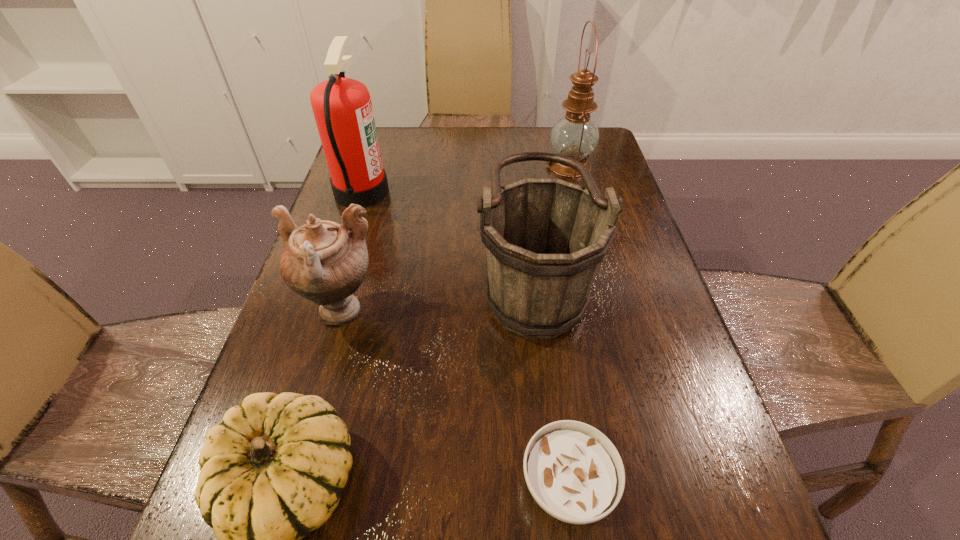
Where is `oil lamp`? The image size is (960, 540). oil lamp is located at coordinates (575, 135).

Image resolution: width=960 pixels, height=540 pixels. I want to click on fire extinguisher, so click(342, 107).

Locate an element on the screen. The image size is (960, 540). bucket is located at coordinates (545, 239).

At what (x,y) coordinates should I click in order to perform the action: click on urn. Please return your answer as a coordinate pair (x, y). Looking at the image, I should click on (322, 261).

You are a GUI agent. You are given a task and a screenshot of the screen. Output one action in this format:
    pyautogui.click(x=<x>, y=<y>)
    Task: Click on the soup bowl
    This screenshot has width=960, height=540.
    Given the screenshot: What is the action you would take?
    pyautogui.click(x=573, y=471)

Find the location of a particular element. This screenshot has width=960, height=540. vacant space situated on the left of the oil lamp is located at coordinates (420, 166).

Where is `vacant space located at the nozzle of the fire extinguisher`? vacant space located at the nozzle of the fire extinguisher is located at coordinates (414, 192).

Where is `free space located on the handle side of the bucket`? The height and width of the screenshot is (540, 960). free space located on the handle side of the bucket is located at coordinates (324, 282).

In order to click on free space located 0.200m on the handle side of the bucket in this screenshot , I will do `click(387, 282)`.

The width and height of the screenshot is (960, 540). Find the location of `vacant space located 0.050m on the handle side of the bucket`. vacant space located 0.050m on the handle side of the bucket is located at coordinates (455, 282).